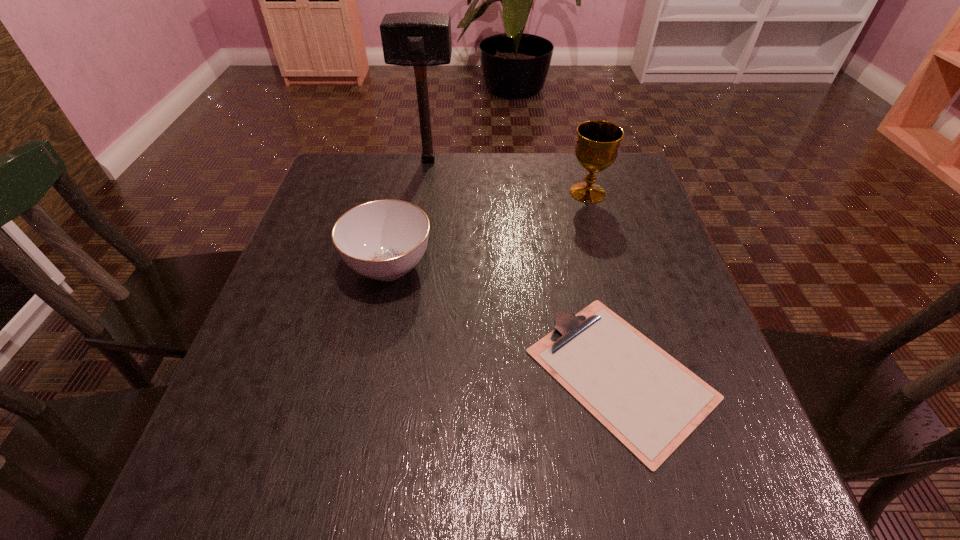
Identify the location of the farthest object. Image resolution: width=960 pixels, height=540 pixels. (419, 39).

The width and height of the screenshot is (960, 540). What are the coordinates of `mallet` in the screenshot? It's located at pos(419,39).

In order to click on chalice in this screenshot , I will do `click(597, 146)`.

Identify the location of the third shortest object. (597, 146).

Find the location of a particular element. This screenshot has height=540, width=960. the third tallest object is located at coordinates (383, 240).

Find the location of `chinaware`. chinaware is located at coordinates (383, 240).

Identify the location of clipboard. pos(650,402).

Where is `the nearest object`? The height and width of the screenshot is (540, 960). the nearest object is located at coordinates (650, 402).

Locate an element on the screen. Image resolution: width=960 pixels, height=540 pixels. free space located on the left of the mallet is located at coordinates (337, 160).

Locate an element on the screen. This screenshot has width=960, height=540. free space located on the left of the third shortest object is located at coordinates (465, 193).